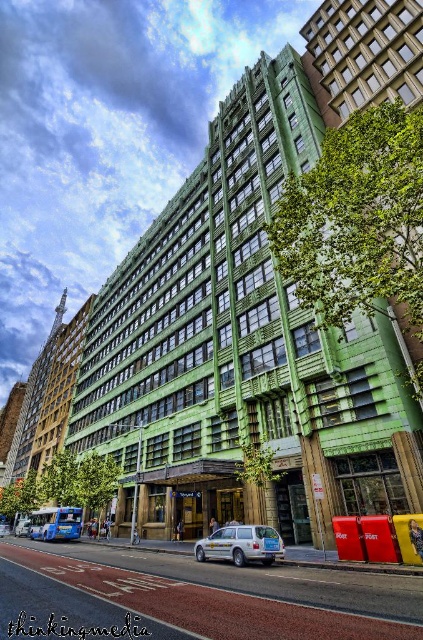
Which is above, white plastic car at center or matte silver station wagon at center?

matte silver station wagon at center is higher up.

Where is `white plastic car at center`? white plastic car at center is located at coordinates (x=235, y=598).